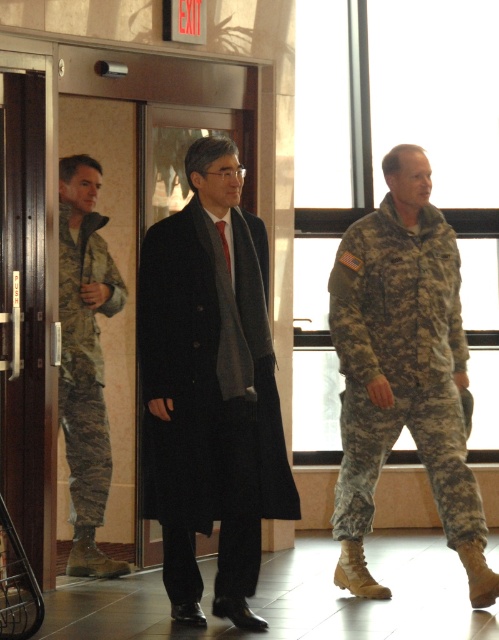
Question: Among these points, which one is nearest to the camera?

Choices:
 (A) (210, 467)
 (B) (423, 452)

Answer: (A)

Question: Which object is positioned closest to the camouflage uniform at right?

Choices:
 (A) camouflage uniform at left
 (B) black wool coat at center

Answer: (B)

Question: Is black wool coat at center above camouflage uniform at right?

Choices:
 (A) no
 (B) yes

Answer: (A)

Question: Which object appears closest to the camera in this image?

Choices:
 (A) black wool coat at center
 (B) camouflage uniform at right
 (C) camouflage uniform at left

Answer: (A)

Question: Can you confirm if black wool coat at center is positioned to the right of camouflage uniform at right?

Choices:
 (A) no
 (B) yes

Answer: (A)

Question: Does black wool coat at center come in front of camouflage uniform at left?

Choices:
 (A) no
 (B) yes

Answer: (B)